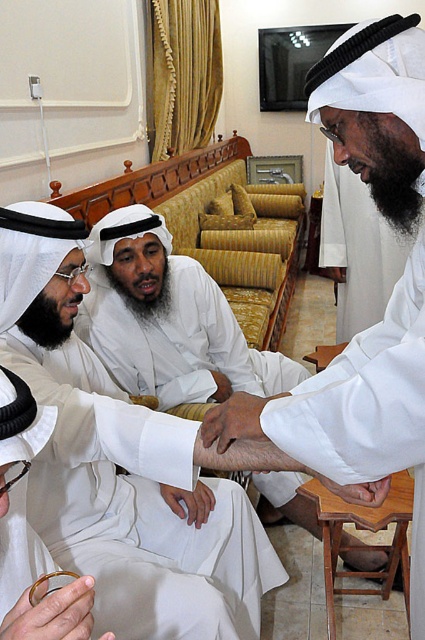
You are a guest entering the room and want to sit down. You see the wooden stool at lower right and the smooth skin hand at lower right. Which object is bigger and can accommodate your body?

The wooden stool at lower right is larger in size than the smooth skin hand at lower right, so the wooden stool at lower right can accommodate your body.